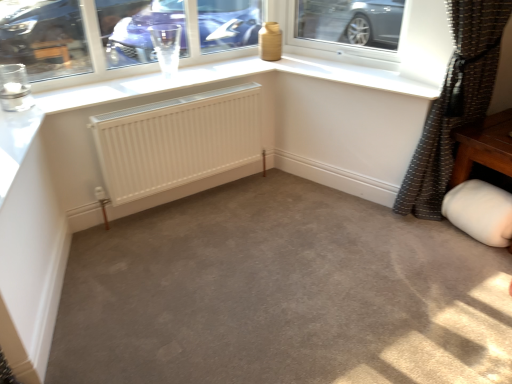
Where is `vacant space in front of brown textured curtain at right`? This screenshot has width=512, height=384. vacant space in front of brown textured curtain at right is located at coordinates (424, 264).